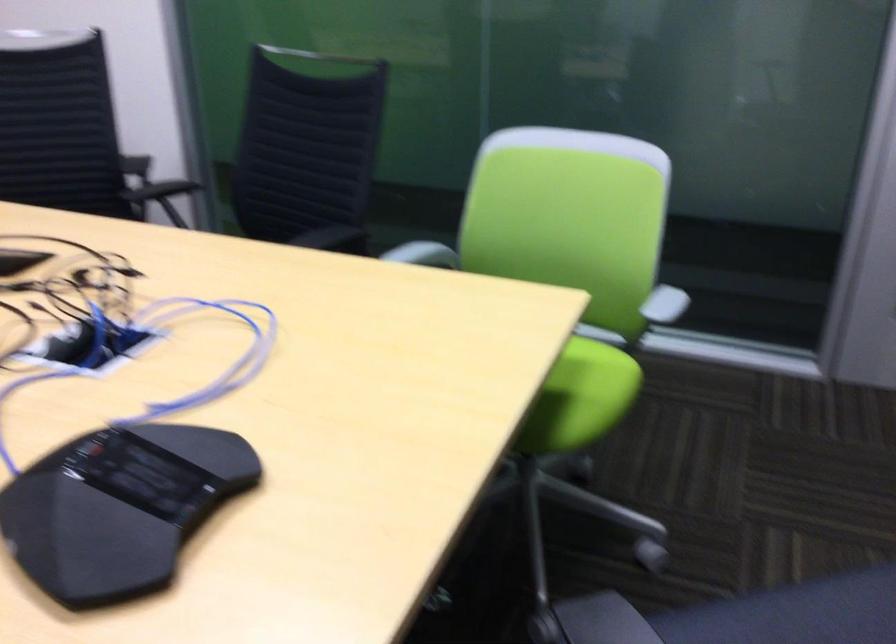
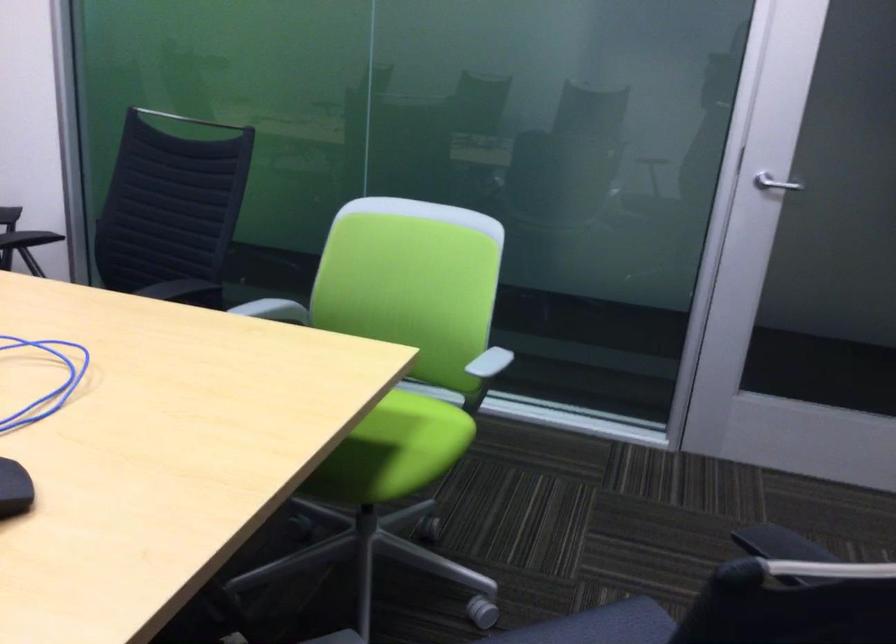
Question: The camera is either moving clockwise (left) or counter-clockwise (right) around the object. The first image is from the beginning of the video and the second image is from the end. Is the camera moving left or right when shooting the video?

Choices:
 (A) Left
 (B) Right

Answer: (A)